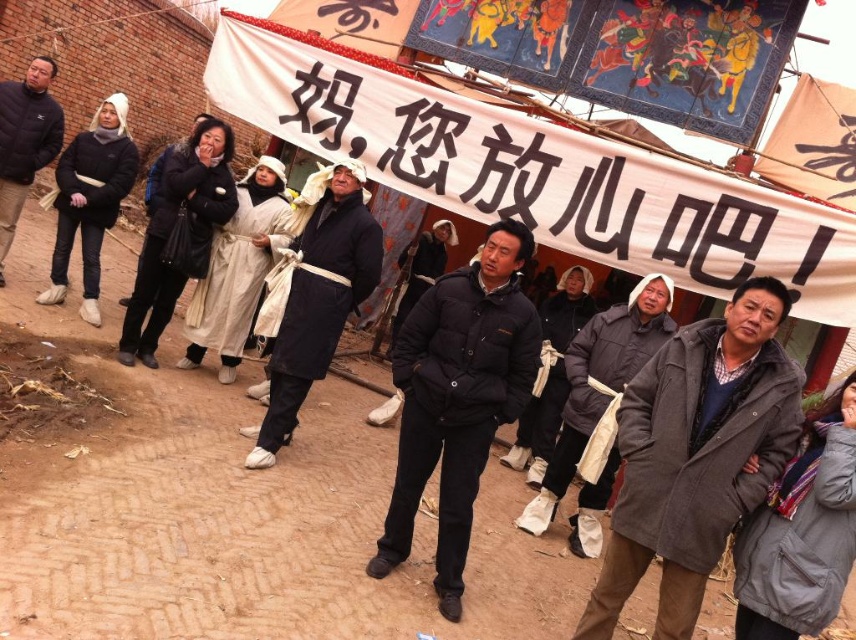
Question: Among these objects, which one is farthest from the camera?

Choices:
 (A) dark gray puffy coat at center
 (B) dark blue fabric coat at center

Answer: (A)

Question: Which object appears closest to the camera in this image?

Choices:
 (A) black matte jacket at center
 (B) dark gray wool coat at center

Answer: (A)

Question: Is white paper banner at upper center bigger than dark gray puffy coat at center?

Choices:
 (A) yes
 (B) no

Answer: (A)

Question: Can you confirm if black matte jacket at center is bigger than beige woolen robe at center?

Choices:
 (A) yes
 (B) no

Answer: (B)

Question: Which point is closer to the camera?

Choices:
 (A) gray cotton coat at lower right
 (B) black matte coat at center

Answer: (A)

Question: Is white paper banner at upper center closer to camera compared to beige woolen robe at center?

Choices:
 (A) no
 (B) yes

Answer: (B)